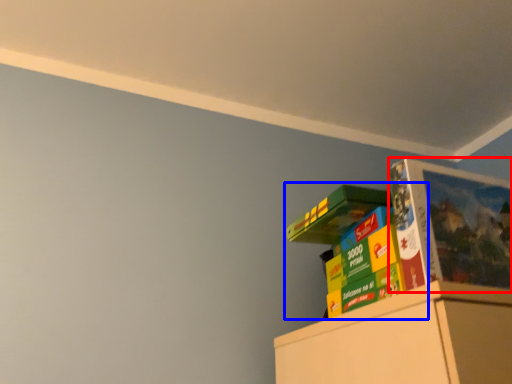
Question: Among these objects, which one is farthest to the camera, paperback book (highlighted by a red box) or book (highlighted by a blue box)?

Choices:
 (A) paperback book
 (B) book

Answer: (B)